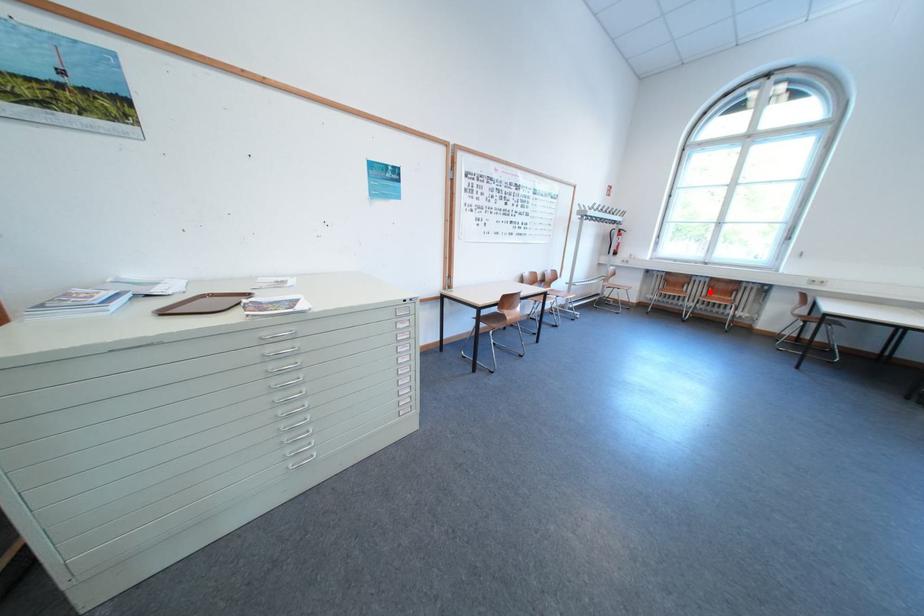
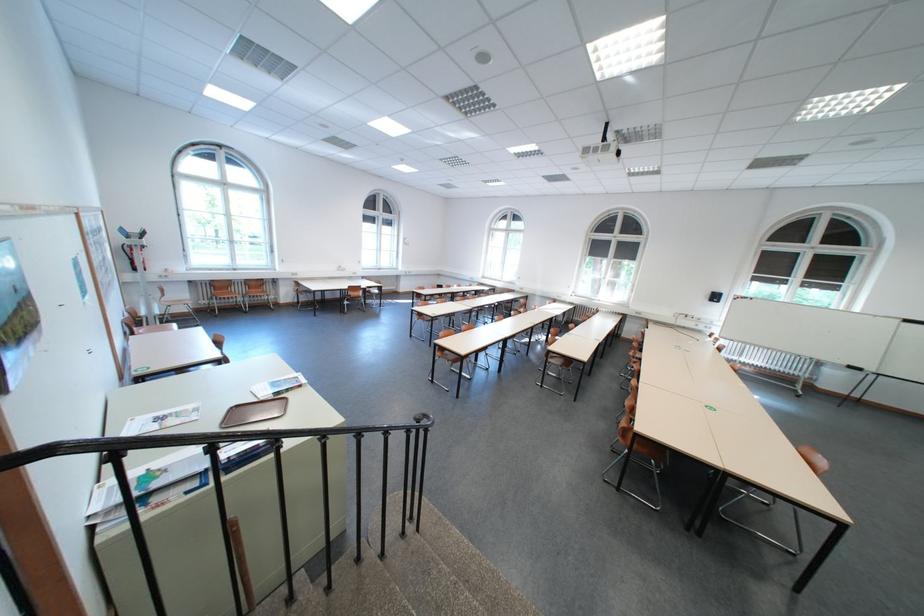
Question: I am providing you with two images of the same scene from different viewpoints. Given a red point in image1, look at the same physical point in image2. Is it:

Choices:
 (A) Closer to the viewpoint
 (B) Farther from the viewpoint

Answer: (A)